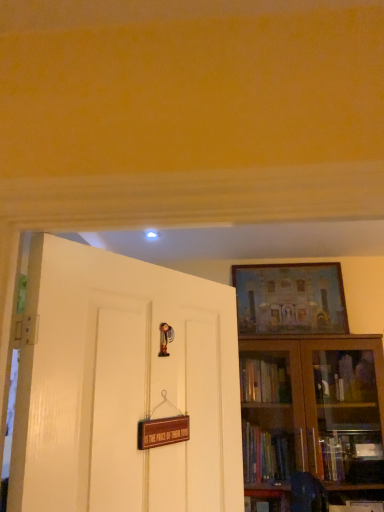
Question: Is matte wooden picture frame at upper right oriented towards white glossy door at left?

Choices:
 (A) no
 (B) yes

Answer: (B)

Question: Can you confirm if matte wooden picture frame at upper right is positioned to the left of white glossy door at left?

Choices:
 (A) no
 (B) yes

Answer: (A)

Question: From the image's perspective, is matte wooden picture frame at upper right located above white glossy door at left?

Choices:
 (A) no
 (B) yes

Answer: (B)

Question: Considering the relative positions of matte wooden picture frame at upper right and white glossy door at left in the image provided, is matte wooden picture frame at upper right in front of white glossy door at left?

Choices:
 (A) no
 (B) yes

Answer: (A)

Question: Considering the relative sizes of matte wooden picture frame at upper right and white glossy door at left in the image provided, is matte wooden picture frame at upper right bigger than white glossy door at left?

Choices:
 (A) yes
 (B) no

Answer: (B)

Question: Is matte wooden picture frame at upper right positioned far away from white glossy door at left?

Choices:
 (A) yes
 (B) no

Answer: (A)

Question: From a real-world perspective, does brown wooden bookcase at right stand above matte wooden picture frame at upper right?

Choices:
 (A) yes
 (B) no

Answer: (B)

Question: Is brown wooden bookcase at right facing away from matte wooden picture frame at upper right?

Choices:
 (A) yes
 (B) no

Answer: (B)

Question: Is brown wooden bookcase at right in contact with matte wooden picture frame at upper right?

Choices:
 (A) yes
 (B) no

Answer: (B)

Question: Does brown wooden bookcase at right lie behind matte wooden picture frame at upper right?

Choices:
 (A) yes
 (B) no

Answer: (B)

Question: Can you confirm if brown wooden bookcase at right is bigger than matte wooden picture frame at upper right?

Choices:
 (A) no
 (B) yes

Answer: (B)

Question: Is brown wooden bookcase at right at the left side of matte wooden picture frame at upper right?

Choices:
 (A) yes
 (B) no

Answer: (B)

Question: Considering the relative sizes of white glossy door at left and brown wooden bookcase at right in the image provided, is white glossy door at left shorter than brown wooden bookcase at right?

Choices:
 (A) no
 (B) yes

Answer: (B)